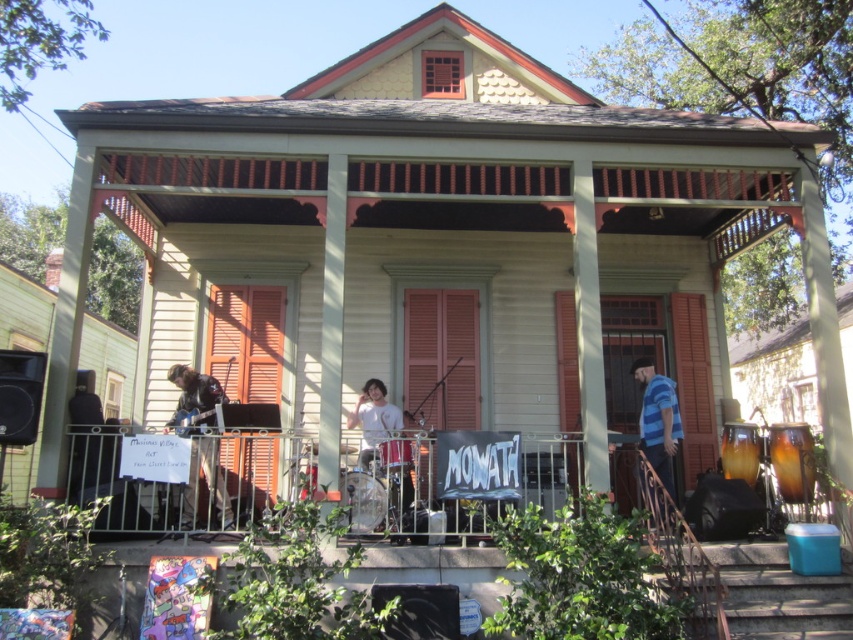
Question: Is leather jacket at left to the left of shiny metallic drum at center from the viewer's perspective?

Choices:
 (A) no
 (B) yes

Answer: (B)

Question: Is leather jacket at left smaller than white matte shirt at center?

Choices:
 (A) no
 (B) yes

Answer: (A)

Question: Where is leather jacket at left located in relation to white matte shirt at center in the image?

Choices:
 (A) below
 (B) above

Answer: (B)

Question: Which point is farther to the camera?

Choices:
 (A) (392, 449)
 (B) (676, 497)
 (C) (187, 500)
 (D) (387, 428)

Answer: (B)

Question: Among these points, which one is farthest from the camera?

Choices:
 (A) (199, 445)
 (B) (665, 436)

Answer: (B)

Question: Which of the following is the farthest from the observer?

Choices:
 (A) shiny metallic drum at center
 (B) leather jacket at left

Answer: (A)